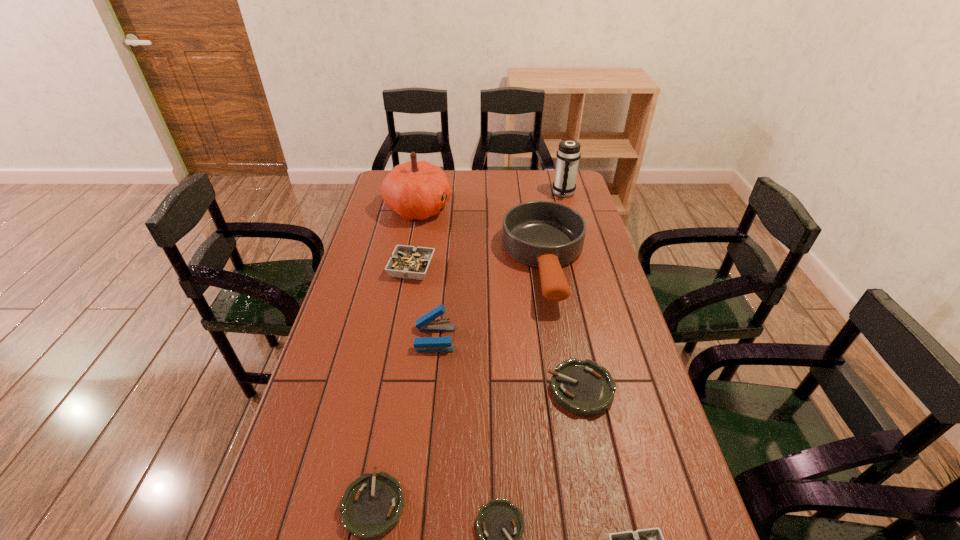
At what (x,y) coordinates should I click in order to perform the action: click on vacant space located on the front-facing side of the pumpkin. Please return your answer as a coordinate pair (x, y). Looking at the image, I should click on (507, 208).

This screenshot has width=960, height=540. What are the coordinates of `vacant space located on the side with the handle of the thermos bottle` in the screenshot? It's located at (579, 248).

I want to click on free location located 0.340m on the handle side of the pan, so click(571, 411).

Where is `vacant region located 0.360m on the right of the fifth farthest object`? vacant region located 0.360m on the right of the fifth farthest object is located at coordinates (574, 339).

Locate an element on the screen. free space located on the left of the fifth tallest object is located at coordinates (361, 268).

The width and height of the screenshot is (960, 540). I want to click on vacant space located 0.230m on the front of the fourth nearest object, so click(x=607, y=512).

At what (x,y) coordinates should I click in order to perform the action: click on pumpkin positioned at the far edge. Please return your answer as a coordinate pair (x, y). Looking at the image, I should click on (414, 190).

Find the location of a particular element. This screenshot has width=960, height=540. thermos bottle that is at the far edge is located at coordinates (568, 154).

At what (x,y) coordinates should I click in order to perform the action: click on pumpkin positioned at the left edge. Please return your answer as a coordinate pair (x, y). The height and width of the screenshot is (540, 960). Looking at the image, I should click on pos(414,190).

Find the location of `ashtray situated at the left edge`. ashtray situated at the left edge is located at coordinates (409, 262).